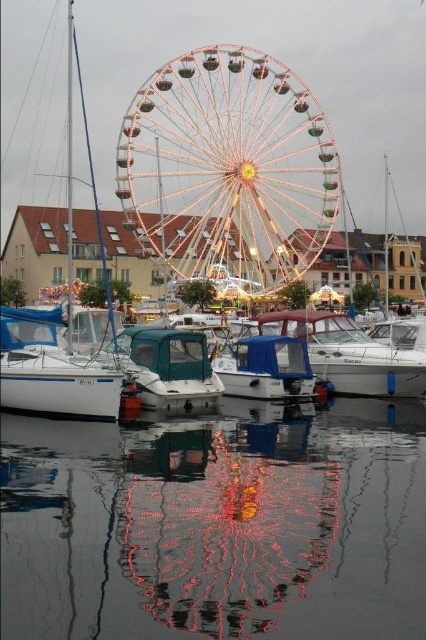
Question: In this image, where is white plastic boat at center located relative to white glossy boat at center?

Choices:
 (A) above
 (B) below

Answer: (A)

Question: Which object is the farthest from the teal matte boat at center?

Choices:
 (A) glossy reflective water at lower center
 (B) white glossy sailboat at left

Answer: (A)

Question: Which is farther from the blue matte boat at center?

Choices:
 (A) teal matte boat at center
 (B) glossy reflective water at lower center
 (C) white glossy boat at center

Answer: (B)

Question: Does white plastic boat at center come behind white glossy boat at center?

Choices:
 (A) no
 (B) yes

Answer: (A)

Question: Can you confirm if illuminated metal ferris wheel at center is thinner than teal matte boat at center?

Choices:
 (A) yes
 (B) no

Answer: (B)

Question: Which point appears farthest from the camera in this image?

Choices:
 (A) (80, 396)
 (B) (175, 200)
 (C) (385, 632)

Answer: (B)